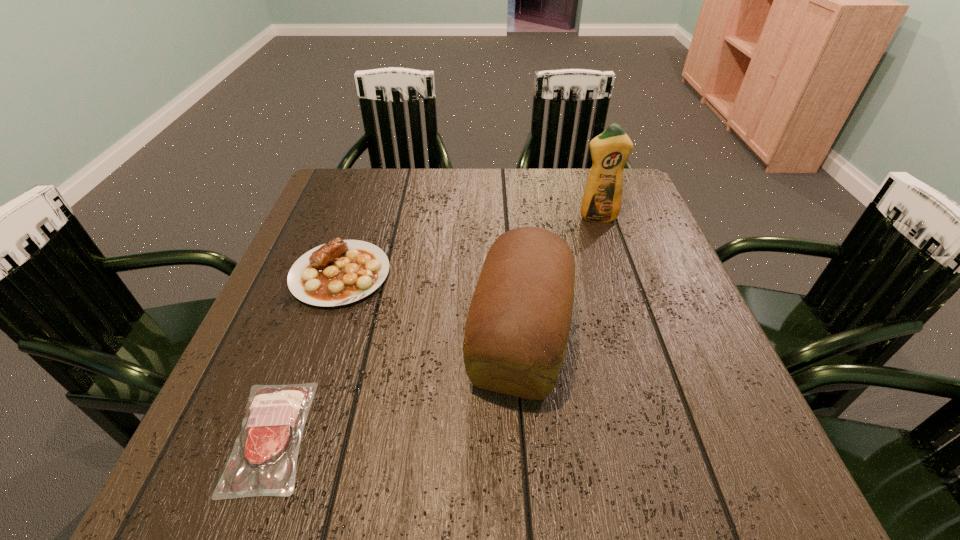
This screenshot has height=540, width=960. What are the coordinates of `vacant position located on the back of the second shortest object` in the screenshot? It's located at point(363,209).

I want to click on vacant space located 0.050m on the right of the shorter steak, so click(x=342, y=436).

This screenshot has height=540, width=960. In order to click on object that is positioned at the far edge in this screenshot , I will do `click(602, 199)`.

Identify the location of object that is at the near edge. 268,445.

Find the location of a particular element. This screenshot has width=960, height=540. object that is at the right edge is located at coordinates (602, 199).

Image resolution: width=960 pixels, height=540 pixels. In order to click on object that is at the near left corner in this screenshot , I will do `click(268, 445)`.

Image resolution: width=960 pixels, height=540 pixels. Identify the location of object that is at the far right corner. (602, 199).

In the image, there is a desktop. At what (x,y) coordinates should I click in order to perform the action: click on vacant space at the far edge. Please return your answer as a coordinate pair (x, y). Image resolution: width=960 pixels, height=540 pixels. Looking at the image, I should click on (456, 179).

In the image, there is a desktop. Where is `vacant space at the near edge`? The height and width of the screenshot is (540, 960). vacant space at the near edge is located at coordinates (496, 483).

You are a GUI agent. You are given a task and a screenshot of the screen. Output one action in this format:
    pyautogui.click(x=<x>, y=<y>)
    Task: Click on the blank area at the right edge
    The image size is (960, 540).
    Given the screenshot: What is the action you would take?
    pyautogui.click(x=652, y=251)